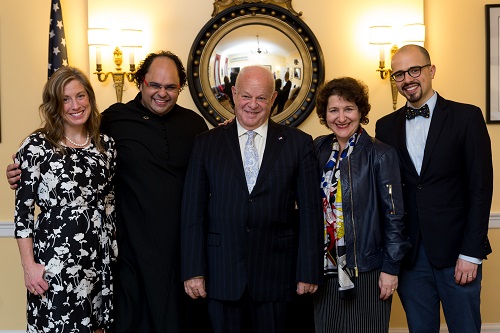
The image size is (500, 333). Find the location of `waist height molding`. waist height molding is located at coordinates (7, 233), (494, 222).